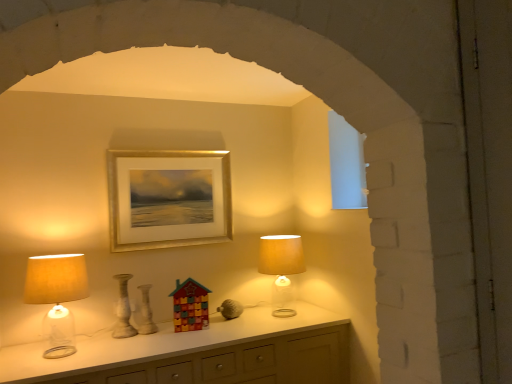
Image resolution: width=512 pixels, height=384 pixels. What do you see at coordinates (123, 310) in the screenshot? I see `speckled ceramic vase at center, which is the 1th vase from left to right` at bounding box center [123, 310].

In the scene shown: What is the approximate width of matte beige lampshade at left, the first lamp in the left-to-right sequence?

12.54 inches.

Find the location of `matte beige lampshade at right, the first lamp viewed from the right`. matte beige lampshade at right, the first lamp viewed from the right is located at coordinates (281, 269).

From the picture: What is the approximate height of gold metallic picture frame at upper center?

The height of gold metallic picture frame at upper center is 27.84 inches.

Image resolution: width=512 pixels, height=384 pixels. Find the location of `speckled ceramic vase at center, which is the 1th vase from left to right`. speckled ceramic vase at center, which is the 1th vase from left to right is located at coordinates (123, 310).

Is white glossy vase at center, the second vase in the left-to-right sequence, not near matte beige lampshade at right, marked as the first lamp in a back-to-front arrangement?

No, white glossy vase at center, the second vase in the left-to-right sequence, is not far from matte beige lampshade at right, marked as the first lamp in a back-to-front arrangement.

From a real-world perspective, is white glossy vase at center, the second vase in the left-to-right sequence, under matte beige lampshade at right, which is the second lamp from left to right?

Indeed, from a real-world perspective, white glossy vase at center, the second vase in the left-to-right sequence, is positioned beneath matte beige lampshade at right, which is the second lamp from left to right.

From the image's perspective, does white glossy vase at center, which is the first vase from right to left, appear lower than matte beige lampshade at right, which is the second lamp from left to right?

Yes, from the image's perspective, white glossy vase at center, which is the first vase from right to left, is below matte beige lampshade at right, which is the second lamp from left to right.

Which is farther, (x=149, y=329) or (x=280, y=268)?

Point (x=280, y=268)

Looking at this image, can you tell me how much speckled ceramic vase at center, the second vase positioned from the right, and matte beige lampshade at right, marked as the first lamp in a back-to-front arrangement, differ in facing direction?

The angle between the facing direction of speckled ceramic vase at center, the second vase positioned from the right, and the facing direction of matte beige lampshade at right, marked as the first lamp in a back-to-front arrangement, is 1.42 degrees.

Is speckled ceramic vase at center, the second vase positioned from the right, at the left side of matte beige lampshade at right, marked as the first lamp in a back-to-front arrangement?

Yes, speckled ceramic vase at center, the second vase positioned from the right, is to the left of matte beige lampshade at right, marked as the first lamp in a back-to-front arrangement.

Which object is further away from the camera taking this photo, speckled ceramic vase at center, the second vase positioned from the right, or matte beige lampshade at right, marked as the first lamp in a back-to-front arrangement?

matte beige lampshade at right, marked as the first lamp in a back-to-front arrangement.

Consider the image. How far apart are speckled ceramic vase at center, the second vase positioned from the right, and matte beige lampshade at right, the first lamp viewed from the right?

speckled ceramic vase at center, the second vase positioned from the right, is 3.38 feet from matte beige lampshade at right, the first lamp viewed from the right.

Is point (186, 228) closer or farther from the camera than point (269, 274)?

Point (186, 228) is positioned farther from the camera compared to point (269, 274).

Is gold metallic picture frame at upper center facing towards matte beige lampshade at right, the first lamp viewed from the right?

No, gold metallic picture frame at upper center does not turn towards matte beige lampshade at right, the first lamp viewed from the right.

From the image's perspective, which is above, gold metallic picture frame at upper center or matte beige lampshade at right, which is counted as the 2th lamp, starting from the front?

gold metallic picture frame at upper center appears higher in the image.

From a real-world perspective, which object rests below the other?

matte beige lampshade at right, which is the second lamp from left to right, from a real-world perspective.

Can you tell me how much matte beige lampshade at right, which is the second lamp from left to right, and speckled ceramic vase at center, which is the 1th vase from left to right, differ in facing direction?

The angular difference between matte beige lampshade at right, which is the second lamp from left to right, and speckled ceramic vase at center, which is the 1th vase from left to right, is 1.42 degrees.

Is matte beige lampshade at right, which is counted as the 2th lamp, starting from the front, smaller than speckled ceramic vase at center, the second vase positioned from the right?

No.

Is matte beige lampshade at right, the first lamp viewed from the right, in contact with speckled ceramic vase at center, which is the 1th vase from left to right?

matte beige lampshade at right, the first lamp viewed from the right, and speckled ceramic vase at center, which is the 1th vase from left to right, are not in contact.

Which is in front, point (279, 263) or point (118, 329)?

Point (118, 329)

Find the location of a particular element. The height and width of the screenshot is (384, 512). lamp in front of the speckled ceramic vase at center, which is the 1th vase from left to right is located at coordinates [57, 296].

Is speckled ceramic vase at center, the second vase positioned from the right, touching matte beige lampshade at left, the first lamp in the left-to-right sequence?

No, speckled ceramic vase at center, the second vase positioned from the right, is not beside matte beige lampshade at left, the first lamp in the left-to-right sequence.

From a real-world perspective, is speckled ceramic vase at center, the second vase positioned from the right, physically above matte beige lampshade at left, which appears as the 1th lamp when viewed from the front?

No.

Would you say matte beige lampshade at left, which is the second lamp in right-to-left order, is part of speckled ceramic vase at center, the second vase positioned from the right,'s contents?

That's incorrect, matte beige lampshade at left, which is the second lamp in right-to-left order, is not inside speckled ceramic vase at center, the second vase positioned from the right.

Find the location of a particular element. Image resolution: width=512 pixels, height=384 pixels. picture frame on the right of the white glossy vase at center, the second vase in the left-to-right sequence is located at coordinates (168, 198).

Between white glossy vase at center, which is the first vase from right to left, and gold metallic picture frame at upper center, which one has more height?

With more height is gold metallic picture frame at upper center.

Based on the photo, could you tell me if white glossy vase at center, the second vase in the left-to-right sequence, is facing gold metallic picture frame at upper center?

No, white glossy vase at center, the second vase in the left-to-right sequence, is not oriented towards gold metallic picture frame at upper center.

Is white glossy vase at center, which is the first vase from right to left, not close to gold metallic picture frame at upper center?

No, white glossy vase at center, which is the first vase from right to left, is in close proximity to gold metallic picture frame at upper center.

The image size is (512, 384). Find the location of `vase lying above the white glossy vase at center, the second vase in the left-to-right sequence (from the image's perspective)`. vase lying above the white glossy vase at center, the second vase in the left-to-right sequence (from the image's perspective) is located at coordinates (123, 310).

From a real-world perspective, is white glossy vase at center, the second vase in the left-to-right sequence, above or below speckled ceramic vase at center, the second vase positioned from the right?

white glossy vase at center, the second vase in the left-to-right sequence, is situated lower than speckled ceramic vase at center, the second vase positioned from the right, in the real world.

Is white glossy vase at center, which is the first vase from right to left, spatially inside speckled ceramic vase at center, the second vase positioned from the right, or outside of it?

white glossy vase at center, which is the first vase from right to left, is located beyond the bounds of speckled ceramic vase at center, the second vase positioned from the right.

In the image, is white glossy vase at center, which is the first vase from right to left, positioned in front of or behind speckled ceramic vase at center, the second vase positioned from the right?

Clearly, white glossy vase at center, which is the first vase from right to left, is behind speckled ceramic vase at center, the second vase positioned from the right.

Which vase is the 1st one when counting from the front of the matte beige lampshade at right, which is counted as the 2th lamp, starting from the front? Please provide its 2D coordinates.

[(146, 312)]

Identify the location of vase that is the 1st one when counting downward from the matte beige lampshade at right, the first lamp viewed from the right (from the image's perspective). This screenshot has height=384, width=512. (123, 310).

Based on their spatial positions, is matte beige lampshade at left, which appears as the 1th lamp when viewed from the front, or white glossy vase at center, which is the first vase from right to left, closer to speckled ceramic vase at center, the second vase positioned from the right?

white glossy vase at center, which is the first vase from right to left, is closer to speckled ceramic vase at center, the second vase positioned from the right.

In the scene shown: Considering their positions, is matte beige lampshade at left, the first lamp in the left-to-right sequence, positioned closer to matte beige lampshade at right, the first lamp viewed from the right, than white glossy vase at center, the second vase in the left-to-right sequence?

Among the two, white glossy vase at center, the second vase in the left-to-right sequence, is located nearer to matte beige lampshade at right, the first lamp viewed from the right.

From the image, which object appears to be nearer to matte beige lampshade at left, which is the second lamp in right-to-left order, matte beige lampshade at right, the first lamp viewed from the right, or speckled ceramic vase at center, the second vase positioned from the right?

speckled ceramic vase at center, the second vase positioned from the right, lies closer to matte beige lampshade at left, which is the second lamp in right-to-left order, than the other object.

Based on the photo, estimate the real-world distances between objects in this image. Which object is closer to matte beige lampshade at left, the first lamp in the left-to-right sequence, speckled ceramic vase at center, the second vase positioned from the right, or gold metallic picture frame at upper center?

Among the two, speckled ceramic vase at center, the second vase positioned from the right, is located nearer to matte beige lampshade at left, the first lamp in the left-to-right sequence.

When comparing their distances from matte beige lampshade at right, marked as the first lamp in a back-to-front arrangement, does gold metallic picture frame at upper center or matte beige lampshade at left, which appears as the 1th lamp when viewed from the front, seem closer?

gold metallic picture frame at upper center is positioned closer to the anchor matte beige lampshade at right, marked as the first lamp in a back-to-front arrangement.

Looking at the image, which one is located further to gold metallic picture frame at upper center, white glossy vase at center, the second vase in the left-to-right sequence, or matte beige lampshade at right, which is counted as the 2th lamp, starting from the front?

Among the two, matte beige lampshade at right, which is counted as the 2th lamp, starting from the front, is located further to gold metallic picture frame at upper center.

Which object lies further to the anchor point speckled ceramic vase at center, which is the 1th vase from left to right, white glossy vase at center, the second vase in the left-to-right sequence, or gold metallic picture frame at upper center?

gold metallic picture frame at upper center.

Estimate the real-world distances between objects in this image. Which object is closer to gold metallic picture frame at upper center, matte beige lampshade at right, marked as the first lamp in a back-to-front arrangement, or white glossy vase at center, which is the first vase from right to left?

white glossy vase at center, which is the first vase from right to left, is positioned closer to the anchor gold metallic picture frame at upper center.

You are a GUI agent. You are given a task and a screenshot of the screen. Output one action in this format:
    pyautogui.click(x=<x>, y=<y>)
    Task: Click on the picture frame situated between speckled ceramic vase at center, the second vase positioned from the right, and matte beige lampshade at right, which is the second lamp from left to right, from left to right
    
    Given the screenshot: What is the action you would take?
    pyautogui.click(x=168, y=198)

Where is `vase between gold metallic picture frame at upper center and white glossy vase at center, which is the first vase from right to left, in the vertical direction`? Image resolution: width=512 pixels, height=384 pixels. vase between gold metallic picture frame at upper center and white glossy vase at center, which is the first vase from right to left, in the vertical direction is located at coordinates (123, 310).

Find the location of a particular element. vase located between speckled ceramic vase at center, which is the 1th vase from left to right, and matte beige lampshade at right, the first lamp viewed from the right, in the left-right direction is located at coordinates (146, 312).

You are a GUI agent. You are given a task and a screenshot of the screen. Output one action in this format:
    pyautogui.click(x=<x>, y=<y>)
    Task: Click on the picture frame located between white glossy vase at center, the second vase in the left-to-right sequence, and matte beige lampshade at right, the first lamp viewed from the right, in the left-right direction
    The width and height of the screenshot is (512, 384).
    Given the screenshot: What is the action you would take?
    pyautogui.click(x=168, y=198)